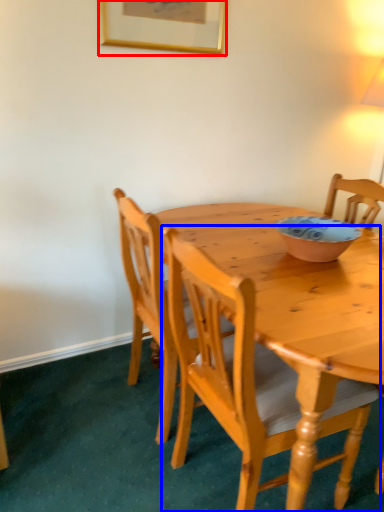
Question: Which object is closer to the camera taking this photo, picture frame (highlighted by a red box) or chair (highlighted by a blue box)?

Choices:
 (A) picture frame
 (B) chair

Answer: (B)